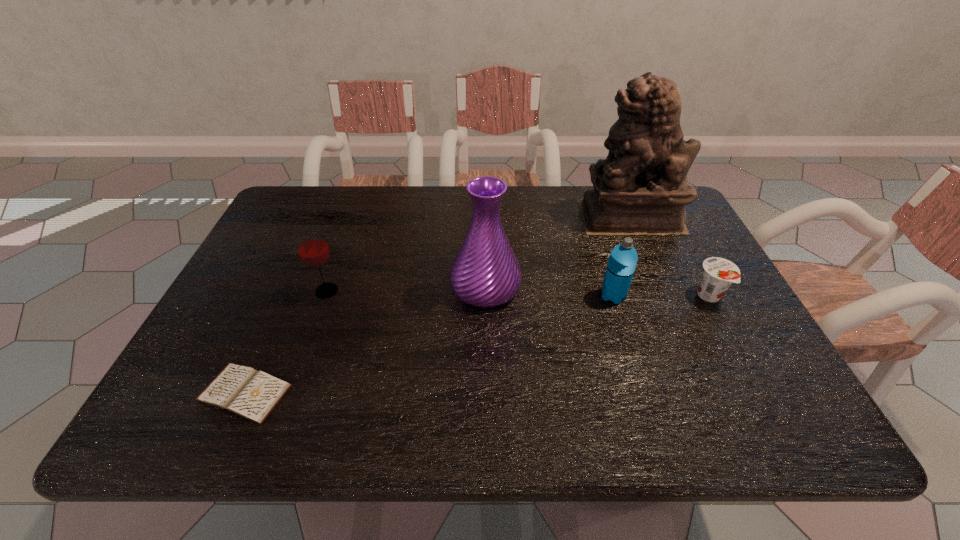
Locate an element on the screen. The height and width of the screenshot is (540, 960). the tallest object is located at coordinates (641, 188).

The width and height of the screenshot is (960, 540). Identify the location of sculpture. (641, 188).

Locate an element on the screen. The width and height of the screenshot is (960, 540). the fourth object from right to left is located at coordinates (485, 272).

I want to click on the fifth shortest object, so click(x=485, y=272).

This screenshot has height=540, width=960. I want to click on glass, so click(x=313, y=250).

Find the location of a particular element. This screenshot has width=960, height=540. thermos bottle is located at coordinates (621, 265).

This screenshot has height=540, width=960. What are the coordinates of `yogurt` in the screenshot? It's located at (718, 274).

Locate an element on the screen. the shortest object is located at coordinates (251, 394).

This screenshot has width=960, height=540. In order to click on the nearest object in this screenshot , I will do `click(251, 394)`.

Identify the location of vacant space situated on the front-facing side of the tallest object. (541, 216).